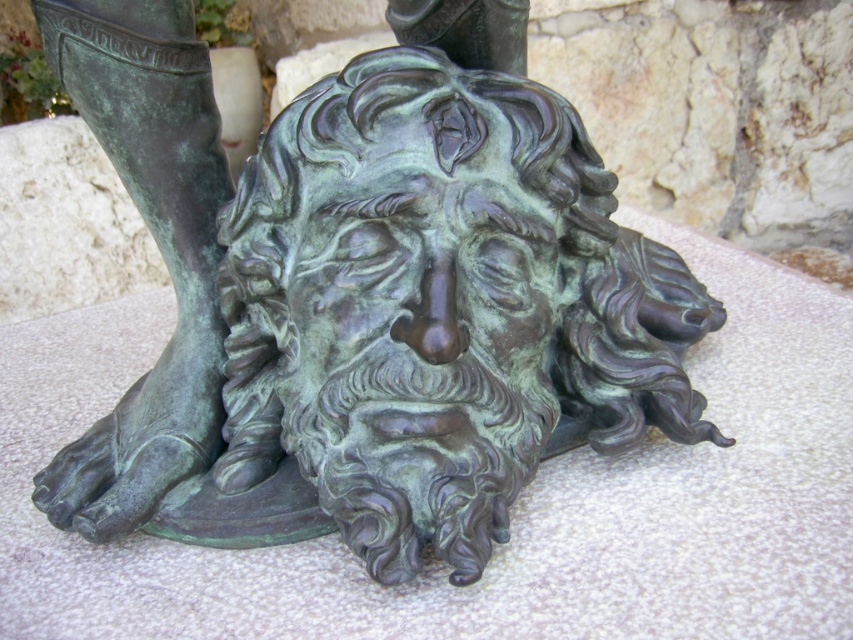
Question: Is green patina bronze face at center to the right of green patina boot at lower left from the viewer's perspective?

Choices:
 (A) no
 (B) yes

Answer: (B)

Question: Does green patina bronze face at center appear under green patina boot at lower left?

Choices:
 (A) yes
 (B) no

Answer: (A)

Question: Among these objects, which one is nearest to the camera?

Choices:
 (A) green patina boot at lower left
 (B) green patina bronze face at center

Answer: (B)

Question: Is green patina bronze face at center thinner than green patina boot at lower left?

Choices:
 (A) yes
 (B) no

Answer: (B)